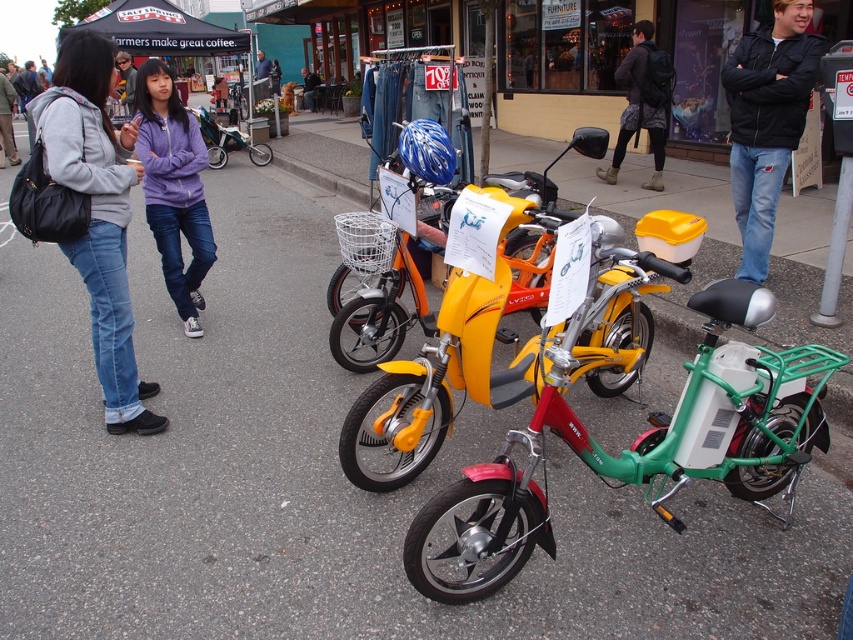
You are a delivery person who needs to pick up a package from the denim jeans at left. The package is on a scooter that is 3 meters away from you. Can you reach the package without moving more than 3 meters?

The denim jeans at left are 3.25 meters away. Since the package is on a scooter that is 3 meters away, you can reach it without moving more than 3 meters because the distance to the denim jeans at left is slightly farther but the package is within the 3 meter limit.